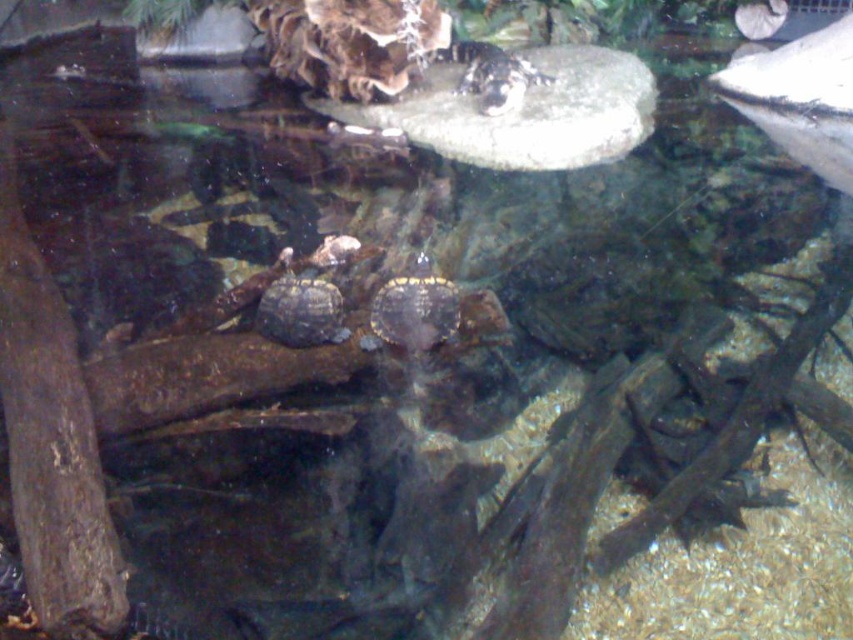
You are a caretaker checking the positioning of the brown matte tortoise at center in the aquarium. According to the coordinates provided, is the tortoise closer to the left or right side of the tank?

The brown matte tortoise at center is located at point 0.487 on the x axis, which is closer to the right side of the tank since 0.487 is just under 0.5, the midpoint between left and right.

You are a turtle enthusiast observing the two tortoises in the aquarium. Which of the two tortoises, the shiny brown tortoise at center or the brown matte tortoise at center, is positioned to the right side of the other?

The shiny brown tortoise at center is positioned to the right of the brown matte tortoise at center.